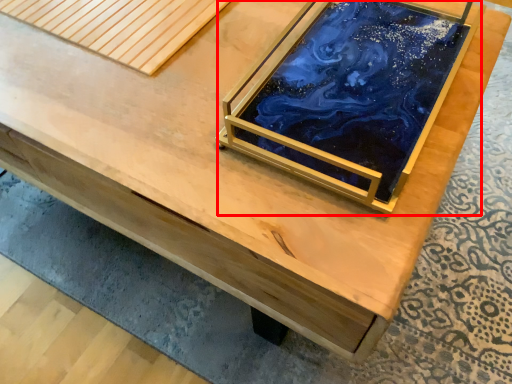
Question: From the image's perspective, where is glass box (annotated by the red box) located in relation to plank in the image?

Choices:
 (A) above
 (B) below

Answer: (B)